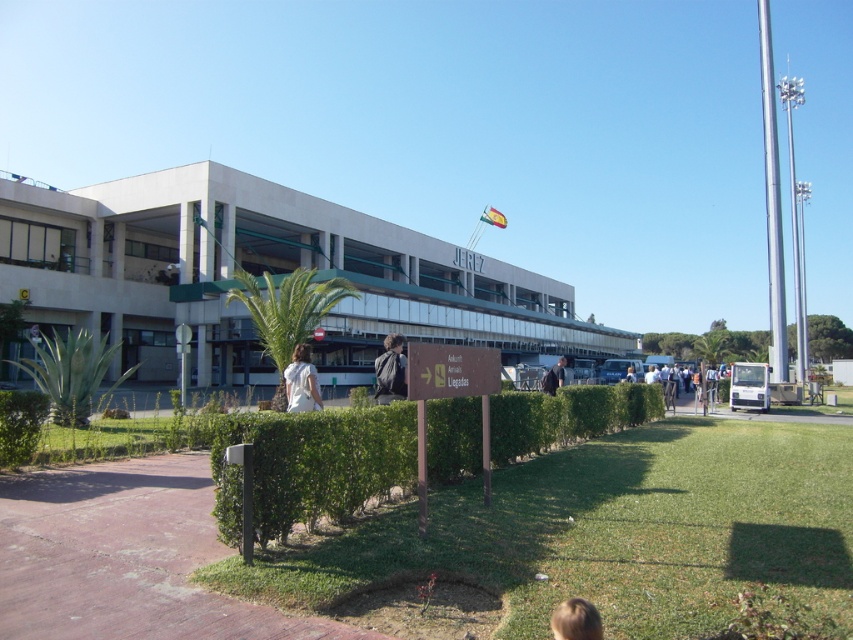
Who is more distant from viewer, (x=315, y=408) or (x=572, y=618)?

The point (x=315, y=408) is behind.

Who is more distant from viewer, (311, 365) or (583, 620)?

The point (311, 365) is more distant.

Locate an element on the screen. This screenshot has height=640, width=853. white fabric shirt at lower center is located at coordinates (300, 381).

Which is more to the right, green grass at lower center or green leafy hedge at center?

Positioned to the right is green grass at lower center.

Between point (712, 572) and point (656, 417), which one is positioned in front?

Point (712, 572) is in front.

Does point (735, 509) come farther from viewer compared to point (282, 513)?

Yes.

What are the coordinates of `green grass at lower center` in the screenshot? It's located at (610, 531).

Is green grass at lower center to the left of dark blue jeans at center from the viewer's perspective?

Yes, green grass at lower center is to the left of dark blue jeans at center.

Locate an element on the screen. The width and height of the screenshot is (853, 640). green grass at lower center is located at coordinates (610, 531).

Where is `green grass at lower center`? Image resolution: width=853 pixels, height=640 pixels. green grass at lower center is located at coordinates (610, 531).